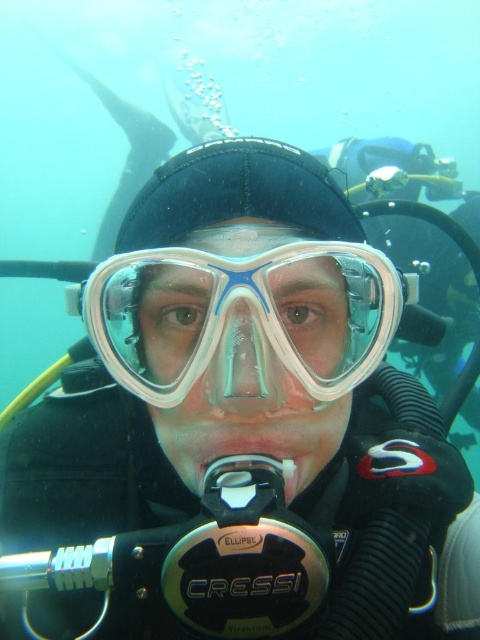
You are a scuba diver wearing the transparent plastic goggles at center. You want to signal to another diver who is 23.66 inches away from you. Can you see them clearly through your goggles?

Yes, the transparent plastic goggles at center allow clear visibility, so you can see the other diver who is 23.66 inches away from you clearly.

You are a scuba diver preparing to descend into the water. You notice the transparent plastic goggles at center and the white plastic mouthpiece at center. Which object is positioned higher on your face?

The transparent plastic goggles at center are positioned higher on your face than the white plastic mouthpiece at center because the transparent plastic goggles at center is above the white plastic mouthpiece at center.

You are a scuba diver preparing to dive underwater. You have a transparent plastic nose at center and a white plastic mouthpiece at center. Which of these items takes up more space?

The white plastic mouthpiece at center occupies more space than the transparent plastic nose at center.